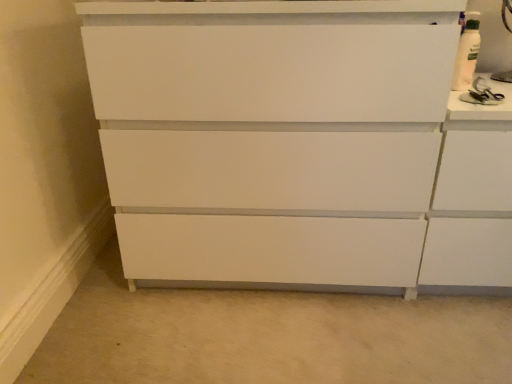
Question: In terms of width, does white textured cabinet at upper right look wider or thinner when compared to white matte chest of drawers at center?

Choices:
 (A) thin
 (B) wide

Answer: (A)

Question: In terms of size, does white textured cabinet at upper right appear bigger or smaller than white matte chest of drawers at center?

Choices:
 (A) big
 (B) small

Answer: (B)

Question: From the image's perspective, relative to white matte chest of drawers at center, is white textured cabinet at upper right above or below?

Choices:
 (A) below
 (B) above

Answer: (A)

Question: Considering the positions of point 505,206 and point 461,281, is point 505,206 closer or farther from the camera than point 461,281?

Choices:
 (A) farther
 (B) closer

Answer: (B)

Question: Based on their positions, is white matte chest of drawers at center located to the left or right of white textured cabinet at upper right?

Choices:
 (A) left
 (B) right

Answer: (A)

Question: From their relative heights in the image, would you say white matte chest of drawers at center is taller or shorter than white textured cabinet at upper right?

Choices:
 (A) tall
 (B) short

Answer: (A)

Question: From a real-world perspective, is white matte chest of drawers at center positioned above or below white textured cabinet at upper right?

Choices:
 (A) above
 (B) below

Answer: (A)